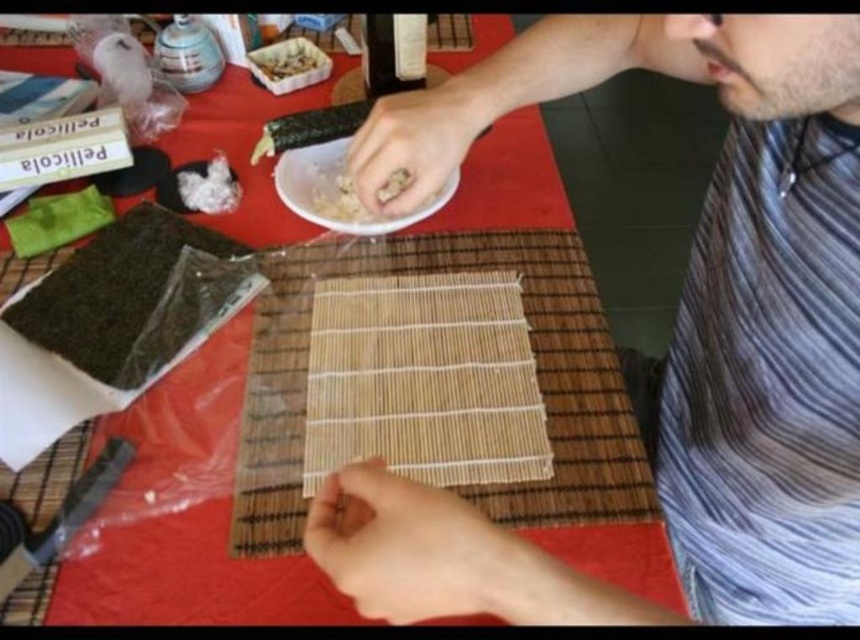
You are a chef observing a sushi preparation area. You notice the striped cotton shirt at center and the white matte plate at center. Which item is taller?

The striped cotton shirt at center is taller than the white matte plate at center.

You are a chef observing someone making sushi. You notice a striped cotton shirt at center and a white matte plate at center. Which object is located to the left of the other?

The striped cotton shirt at center is positioned on the right side of white matte plate at center, so the white matte plate at center is to the left of the striped cotton shirt at center.

You are a chef trying to organize your workspace. You have a bamboo mat at center and a white matte plate at center on your table. Which item should you move if you want to free up more space?

The bamboo mat at center is bigger than the white matte plate at center, so moving the bamboo mat at center would free up more space.